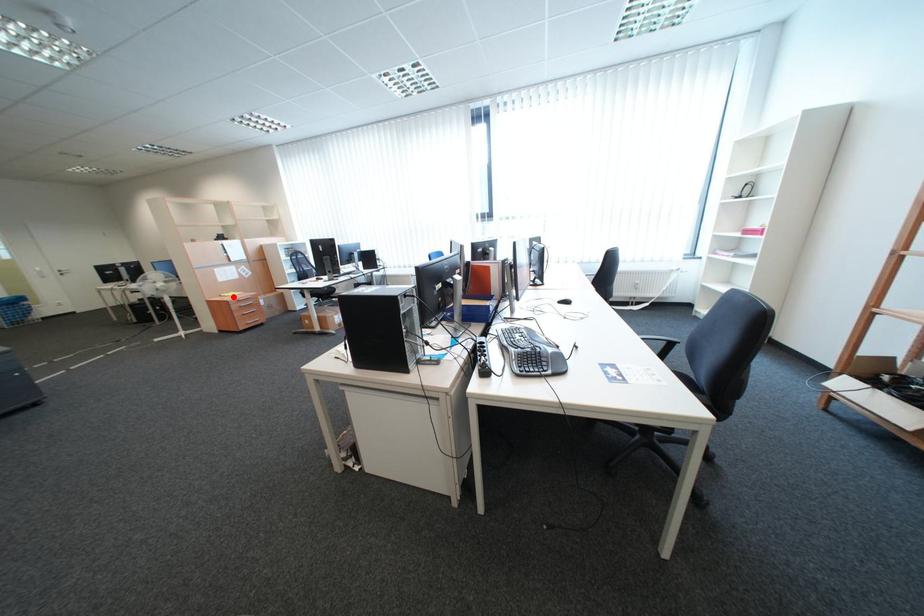
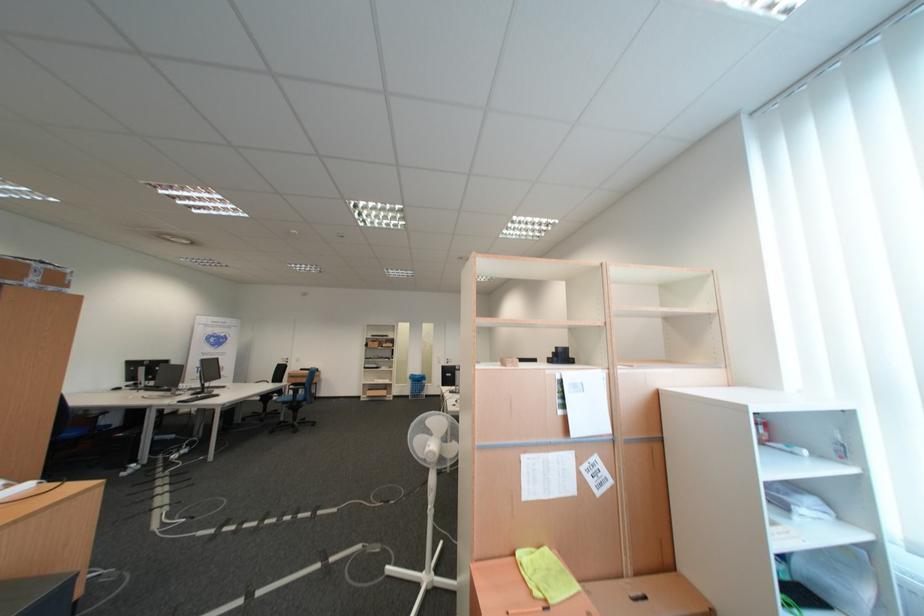
Find the pixel in the second image that matches the highlighted location in the first image.

(526, 556)